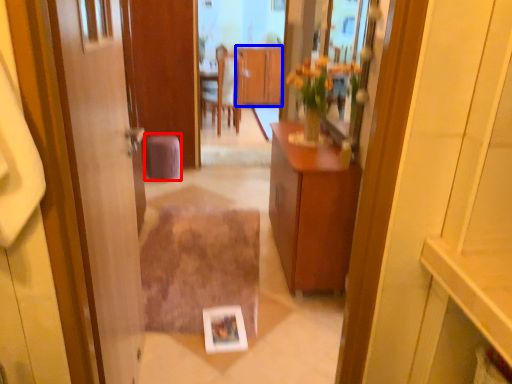
Question: Which point is closer to the camera, stool (highlighted by a red box) or cabinetry (highlighted by a blue box)?

Choices:
 (A) stool
 (B) cabinetry

Answer: (A)